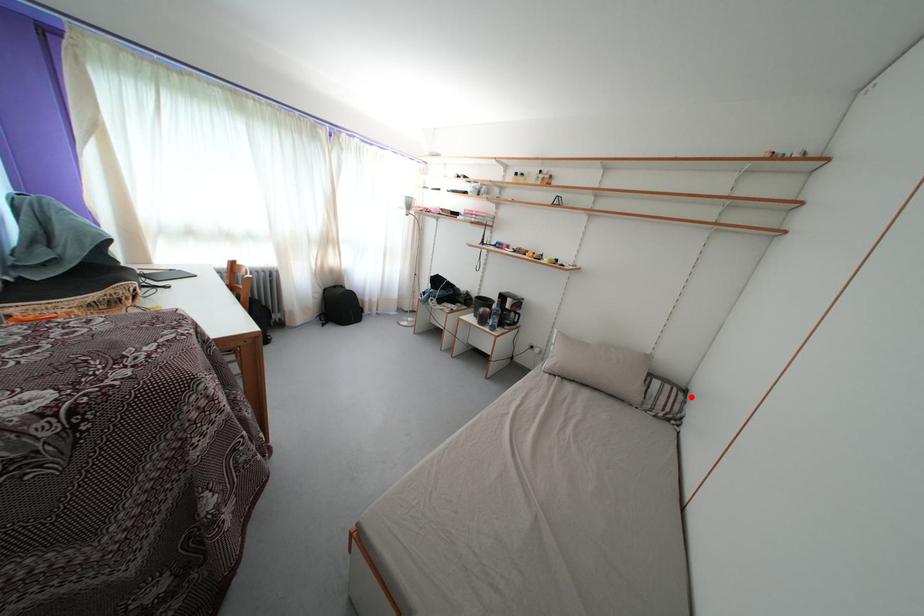
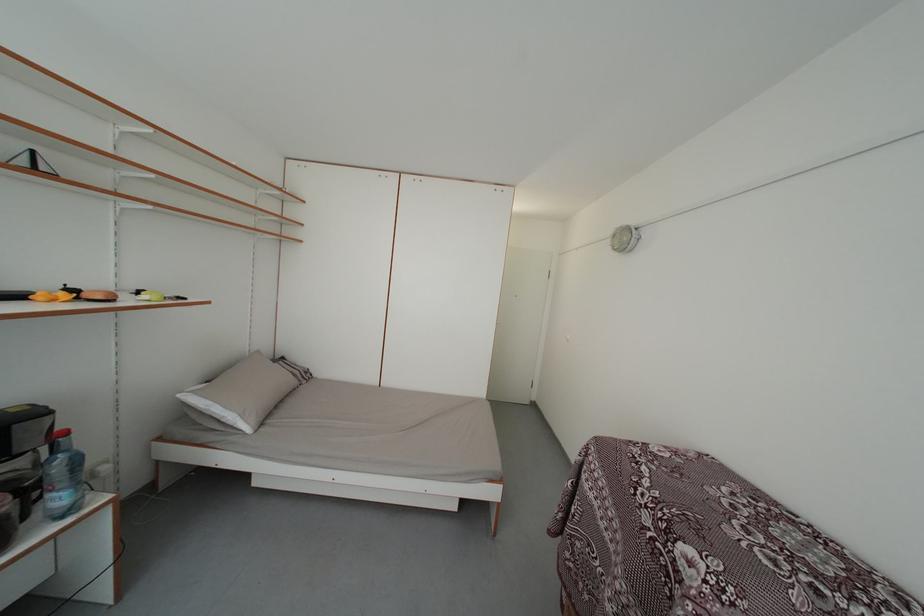
Where in the second image is the point corresponding to the highlighted location from the first image?

(289, 365)